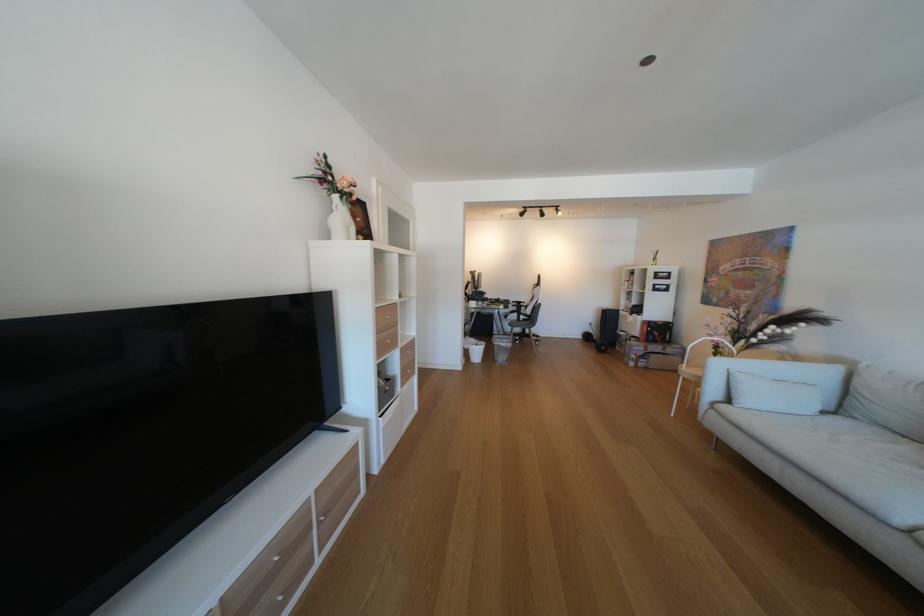
Where would you lean the chair armrest? Please return your answer as a coordinate pair (x, y).

(772, 379)